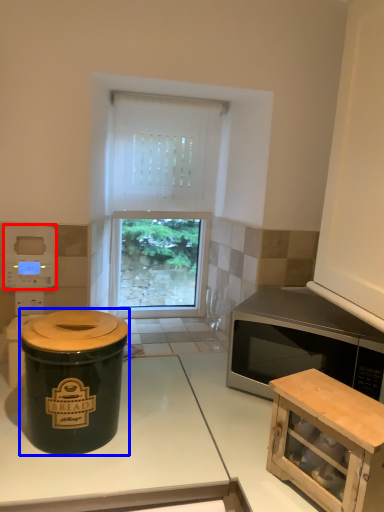
Question: Among these objects, which one is nearest to the camera, appliance (highlighted by a red box) or crock pot (highlighted by a blue box)?

Choices:
 (A) appliance
 (B) crock pot

Answer: (B)